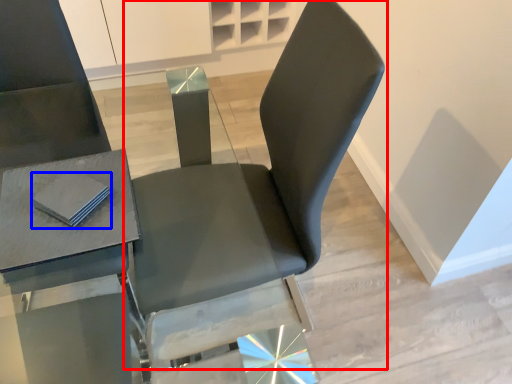
Question: Which of the following is the farthest to the observer, chair (highlighted by a red box) or pad (highlighted by a blue box)?

Choices:
 (A) chair
 (B) pad

Answer: (B)